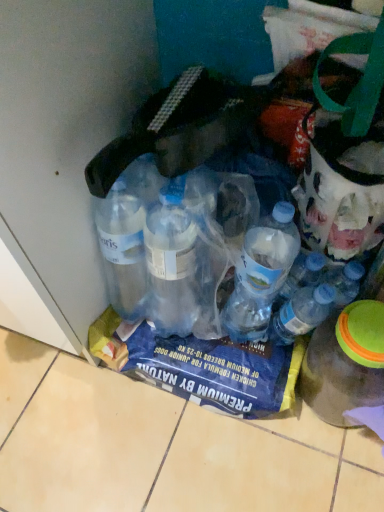
Where is `free point in front of transparent plastic bottle at lower right, which is the 1th bottle from right to left`? The height and width of the screenshot is (512, 384). free point in front of transparent plastic bottle at lower right, which is the 1th bottle from right to left is located at coordinates (332, 466).